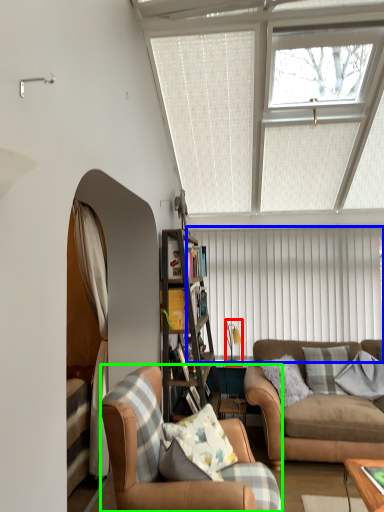
Question: Estimate the real-world distances between objects in this image. Which object is closer to lamp (highlighted by a red box), blind (highlighted by a blue box) or chair (highlighted by a green box)?

Choices:
 (A) blind
 (B) chair

Answer: (A)